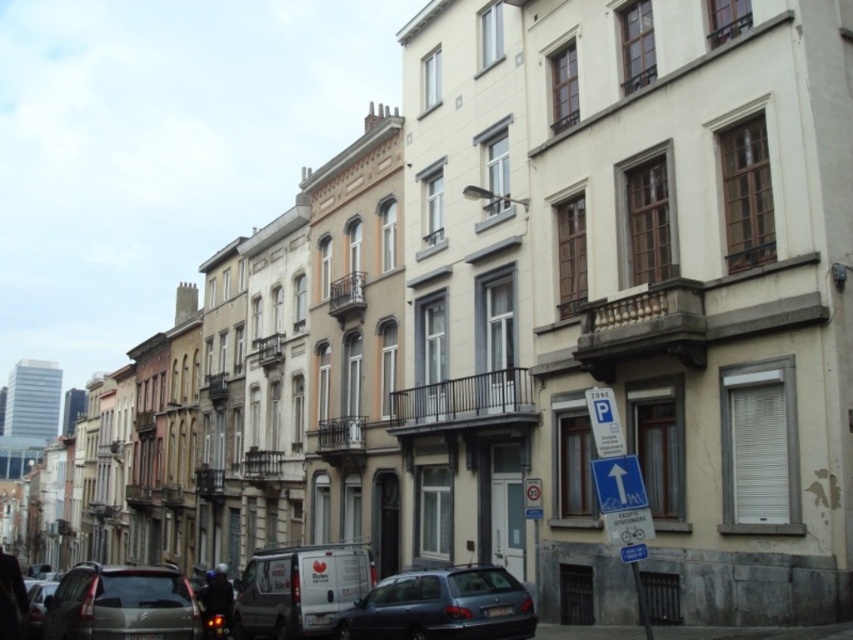
Which is behind, point (410, 573) or point (32, 636)?

The point (410, 573) is behind.

Which of these two, metallic gray hatchback at lower center or shiny silver car at lower left, stands shorter?

metallic gray hatchback at lower center is shorter.

The height and width of the screenshot is (640, 853). What do you see at coordinates (442, 605) in the screenshot?
I see `metallic gray hatchback at lower center` at bounding box center [442, 605].

What are the coordinates of `metallic gray hatchback at lower center` in the screenshot? It's located at (442, 605).

Who is more distant from viewer, (531, 602) or (601, 435)?

Point (531, 602)

Is metallic gray hatchback at lower center positioned in front of blue plastic parking sign at lower right?

No, metallic gray hatchback at lower center is behind blue plastic parking sign at lower right.

Identify the location of metallic gray hatchback at lower center. (442, 605).

Find the location of `metallic gray hatchback at lower center`. metallic gray hatchback at lower center is located at coordinates (442, 605).

Is silver metallic car at lower left taller than shiny silver car at lower left?

In fact, silver metallic car at lower left may be shorter than shiny silver car at lower left.

Does silver metallic car at lower left appear on the right side of shiny silver car at lower left?

Yes, silver metallic car at lower left is to the right of shiny silver car at lower left.

Is point (105, 564) positioned in front of point (38, 604)?

No, it is not.

Locate an element on the screen. silver metallic car at lower left is located at coordinates pyautogui.click(x=120, y=604).